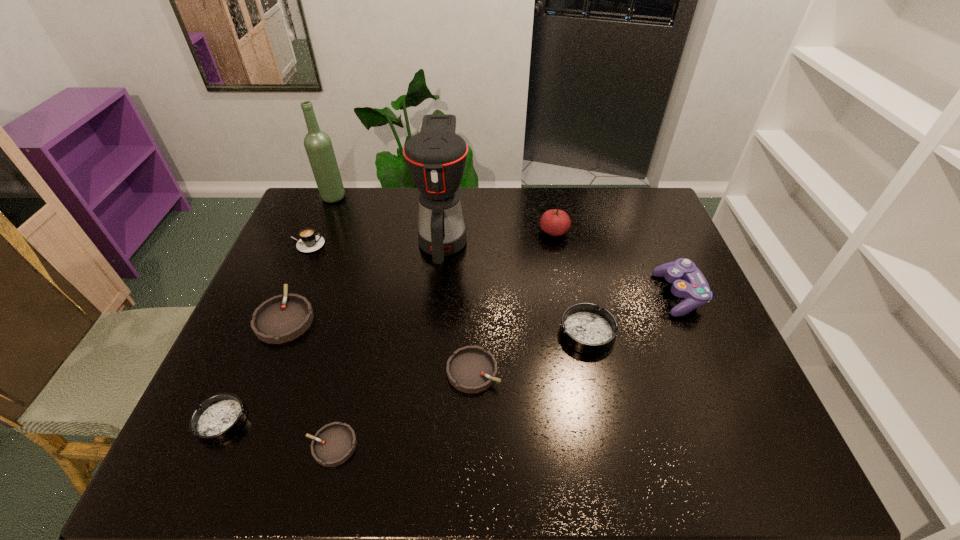
Locate an element on the screen. the bigger dark ashtray is located at coordinates (586, 328).

This screenshot has height=540, width=960. In order to click on the second farthest gray ashtray in this screenshot , I will do `click(471, 369)`.

Locate an element on the screen. The image size is (960, 540). the second smallest gray ashtray is located at coordinates (471, 369).

Find the location of a particular element. the smaller dark ashtray is located at coordinates (219, 417).

Identify the location of the nearer dark ashtray. (219, 417).

This screenshot has width=960, height=540. I want to click on the shortest ashtray, so click(x=333, y=444).

The height and width of the screenshot is (540, 960). I want to click on the second gray ashtray from right to left, so click(333, 444).

Where is `vacant area located on the front of the farthest object`? The image size is (960, 540). vacant area located on the front of the farthest object is located at coordinates (314, 245).

This screenshot has height=540, width=960. I want to click on free point located pour from the carafe of the coffee maker, so click(x=438, y=290).

What are the coordinates of `vacant space located on the front of the red tomato` in the screenshot? It's located at (561, 268).